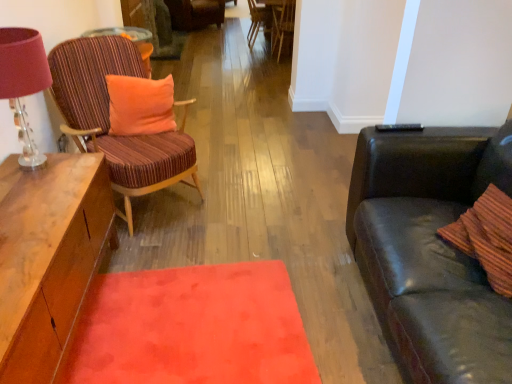
Question: Visually, is wooden chair at center, the second chair viewed from the top, positioned to the left or to the right of matte pink lampshade at left?

Choices:
 (A) right
 (B) left

Answer: (A)

Question: Is wooden chair at center, positioned as the 2th chair in back-to-front order, situated inside matte pink lampshade at left or outside?

Choices:
 (A) outside
 (B) inside

Answer: (A)

Question: Which object is the closest to the wooden chair at center, arranged as the 2th chair when viewed from the front?

Choices:
 (A) orange plush pillow at left
 (B) matte pink lampshade at left
 (C) velvety orange mat at center
 (D) matte wood desk at upper left
 (E) striped fabric chair at left, the 4th chair when ordered from top to bottom

Answer: (D)

Question: Which is farther from the velvety orange mat at center?

Choices:
 (A) orange plush pillow at left
 (B) velvet striped chair at center, arranged as the first chair when viewed from the top
 (C) wooden chair at center, the second chair viewed from the top
 (D) matte wood desk at upper left
 (E) wooden chair at center, the 2th chair from the bottom

Answer: (B)